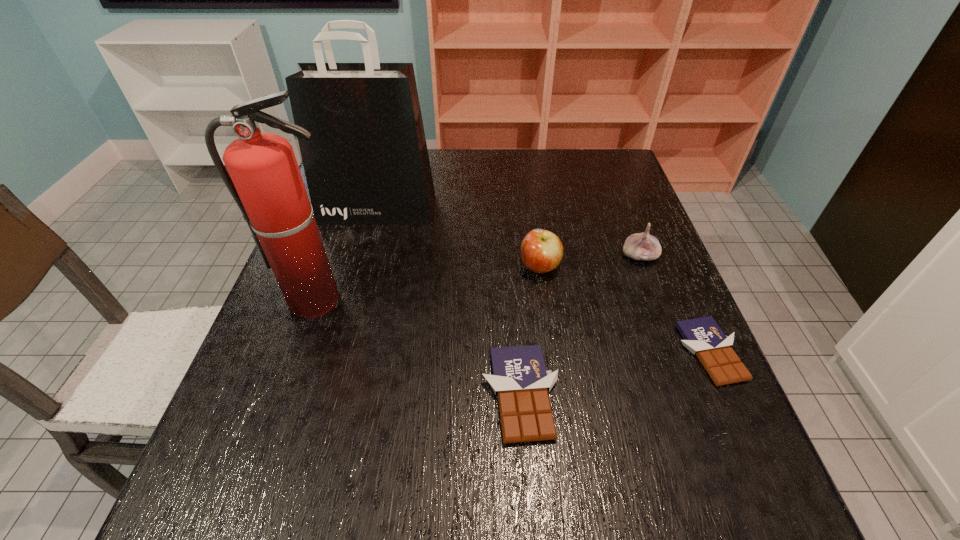
Locate an element on the screen. free space located 0.300m on the front with handles of the shopping bag is located at coordinates (350, 310).

Locate an element on the screen. The image size is (960, 540). vacant space situated 0.390m on the left of the apple is located at coordinates (357, 267).

Identify the location of free space located with the nozzle and gauge on the fire extinguisher. pyautogui.click(x=271, y=429).

Find the location of a particular element. free point located 0.330m on the front of the garlic is located at coordinates (689, 389).

Image resolution: width=960 pixels, height=540 pixels. Identify the location of object situated at the near edge. (520, 379).

What are the coordinates of `shopping bag present at the left edge` in the screenshot? It's located at (366, 163).

The width and height of the screenshot is (960, 540). In order to click on fire extinguisher that is at the left edge in this screenshot , I will do click(265, 181).

This screenshot has height=540, width=960. I want to click on chocolate bar at the right edge, so click(x=703, y=337).

Image resolution: width=960 pixels, height=540 pixels. I want to click on garlic located at the right edge, so click(x=640, y=246).

Find the location of a particular element. vacant space at the far edge of the desktop is located at coordinates (493, 148).